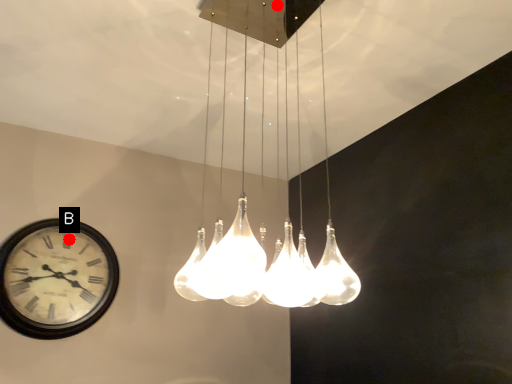
Question: Two points are circled on the image, labeled by A and B beside each circle. Which point is closer to the camera?

Choices:
 (A) A is closer
 (B) B is closer

Answer: (B)